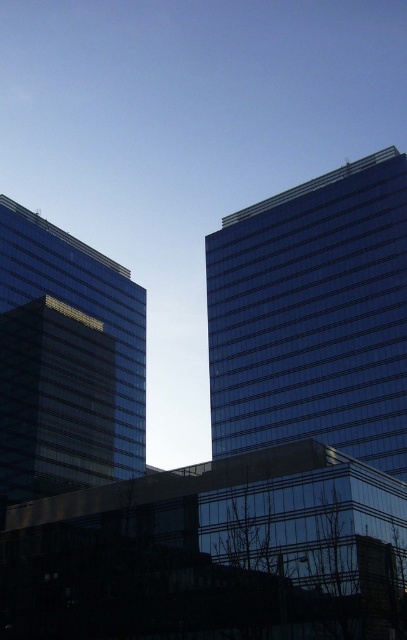
In the scene shown: You are an architect analyzing the image. You need to determine which building has a greater width between the shiny glass building at right and the transparent glass building at left. Based on the scene, what can you conclude?

The shiny glass building at right has a greater width than the transparent glass building at left.

You are an architect analyzing the two buildings in the scene. Which building has a greater height between the shiny glass building at right and the transparent glass building at left?

The transparent glass building at left has a greater height compared to the shiny glass building at right.

You are an architect analyzing the layout of the city. From your vantage point, which building, the shiny glass building at right or the transparent glass building at left, appears closer to you based on their spatial arrangement?

The shiny glass building at right appears closer because it is positioned over the transparent glass building at left, indicating it is in front spatially.